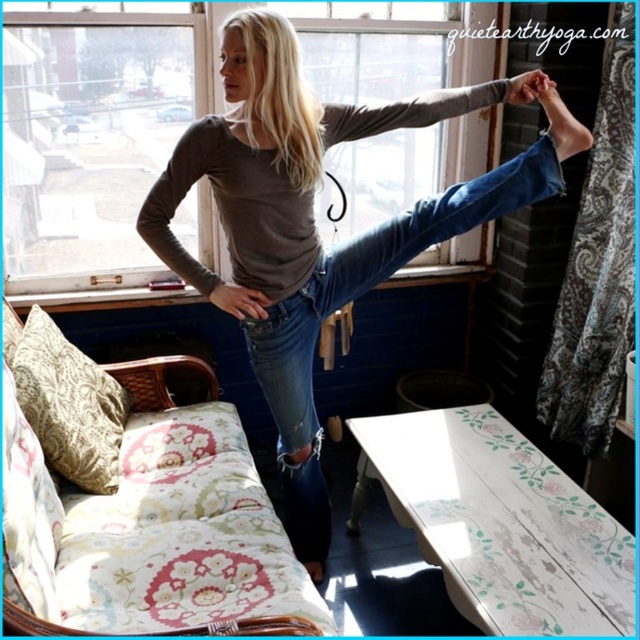
Question: Does floral-patterned fabric pillow at lower left have a smaller size compared to gray matte long-sleeve shirt at upper center?

Choices:
 (A) no
 (B) yes

Answer: (A)

Question: Which object is the farthest from the transparent glass window at upper center?

Choices:
 (A) gray matte long-sleeve shirt at upper center
 (B) white painted wood table at lower right

Answer: (B)

Question: Does transparent glass window at upper center appear under floral-patterned fabric pillow at lower left?

Choices:
 (A) yes
 (B) no

Answer: (B)

Question: Does denim jeans at center appear under floral-patterned fabric pillow at lower left?

Choices:
 (A) no
 (B) yes

Answer: (A)

Question: Among these points, which one is farthest from the camera?

Choices:
 (A) (342, 129)
 (B) (248, 28)

Answer: (A)

Question: Which object is the closest to the gray matte long-sleeve shirt at upper center?

Choices:
 (A) transparent glass window at upper center
 (B) floral-patterned fabric bed at lower left
 (C) denim jeans at center

Answer: (C)